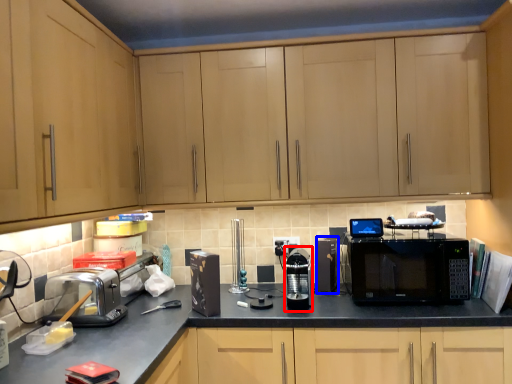
Question: Among these objects, which one is farthest to the camera, appliance (highlighted by a red box) or appliance (highlighted by a blue box)?

Choices:
 (A) appliance
 (B) appliance

Answer: (B)